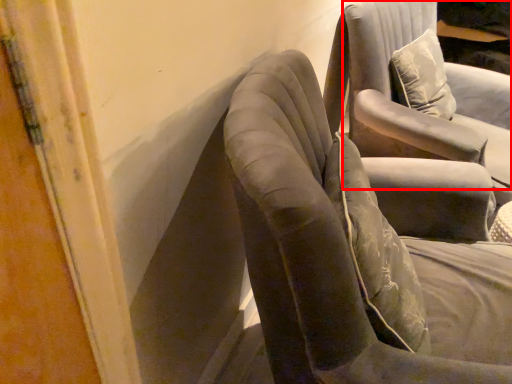
Question: Observing the image, what is the correct spatial positioning of chair (annotated by the red box) in reference to chair?

Choices:
 (A) left
 (B) right

Answer: (B)